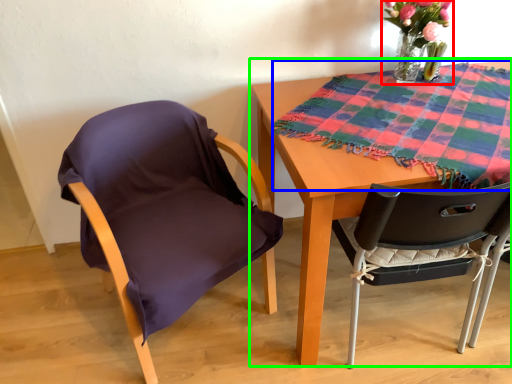
Question: Which object is the farthest from floral arrangement (highlighted by a red box)? Choose among these: blanket (highlighted by a blue box) or table (highlighted by a green box).

Choices:
 (A) blanket
 (B) table

Answer: (B)